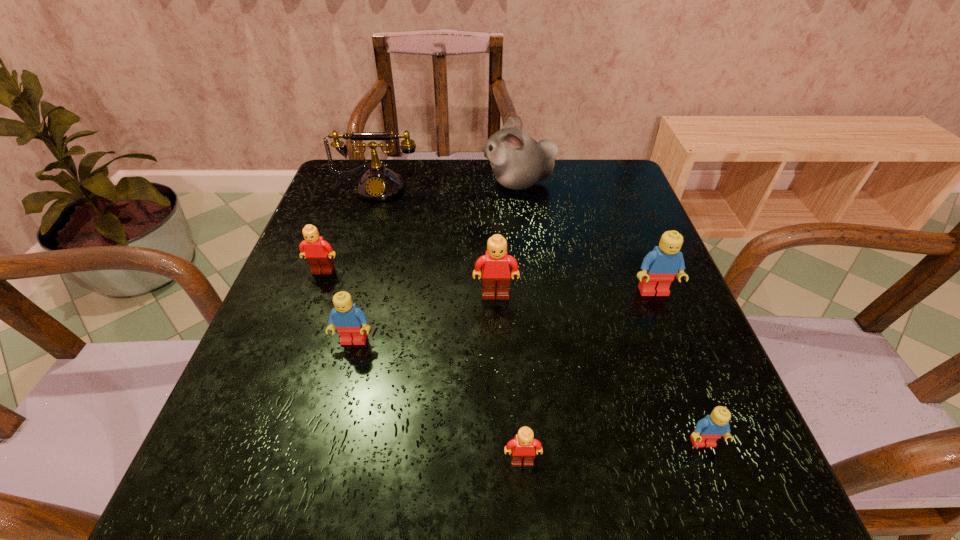
Identify the location of blank area at the near left corner. (260, 463).

Find the location of a particular element. vacant space at the far right corner of the desktop is located at coordinates (618, 163).

Where is `unoccupied area between the third nearest object and the black telephone`? unoccupied area between the third nearest object and the black telephone is located at coordinates (366, 263).

Identify the location of unoccupied position between the black telephone and the smallest brown Lego. This screenshot has width=960, height=540. (450, 323).

At what (x,y) coordinates should I click in order to perform the action: click on free space that is in between the sixth nearest object and the white hamster. Please return your answer as a coordinate pair (x, y). Looking at the image, I should click on (420, 227).

Where is `free spot between the sixth farthest object and the nearest Lego`? The image size is (960, 540). free spot between the sixth farthest object and the nearest Lego is located at coordinates (438, 401).

Image resolution: width=960 pixels, height=540 pixels. I want to click on empty space between the farthest brown Lego and the smallest brown Lego, so click(422, 366).

Where is `vacant area that lies between the third nearest Lego and the hamster`? This screenshot has width=960, height=540. vacant area that lies between the third nearest Lego and the hamster is located at coordinates (436, 261).

Where is `vacant region between the sixth farthest object and the hamster`? vacant region between the sixth farthest object and the hamster is located at coordinates (436, 261).

Where is `free space between the telephone and the nearest brown Lego`? free space between the telephone and the nearest brown Lego is located at coordinates (450, 323).